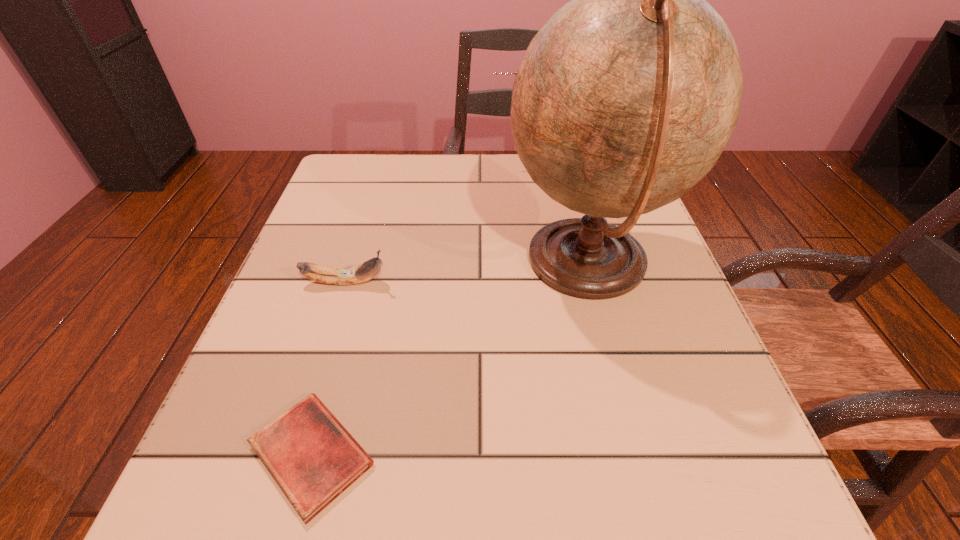
In order to click on free spot that satisfies the following two spatial constraints: 1. at the stem of the diary; 2. on the right side of the second shortest object in this screenshot , I will do `click(292, 454)`.